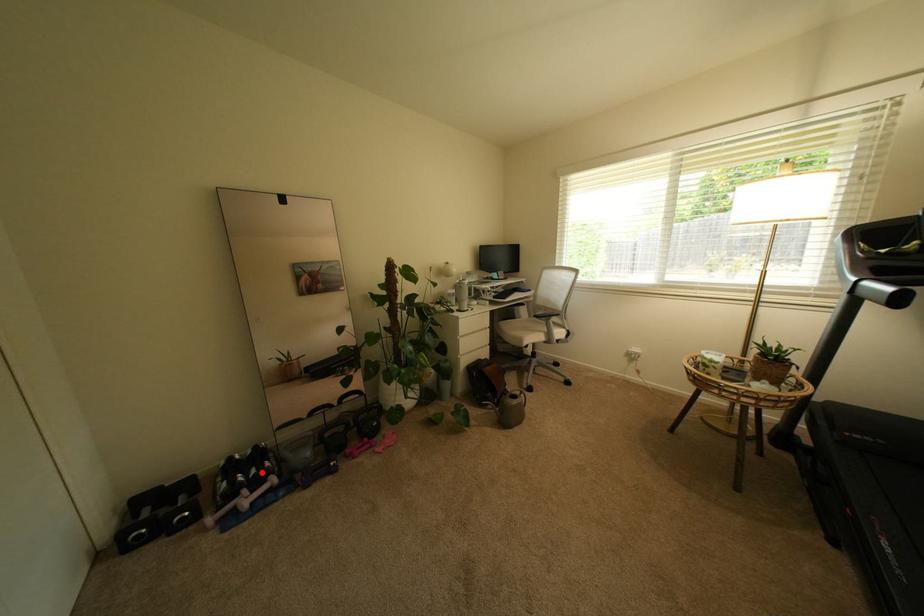
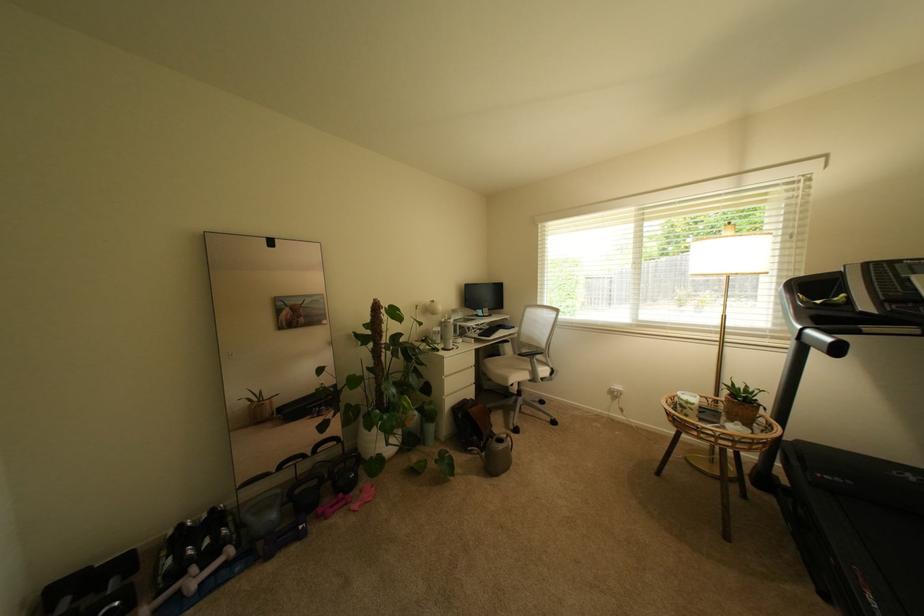
Question: A red point is marked in image1. In image2, is the corresponding 3D point closer to the camera or farther? Reply with the corresponding letter.

Choices:
 (A) The corresponding 3D point is closer.
 (B) The corresponding 3D point is farther.

Answer: (B)